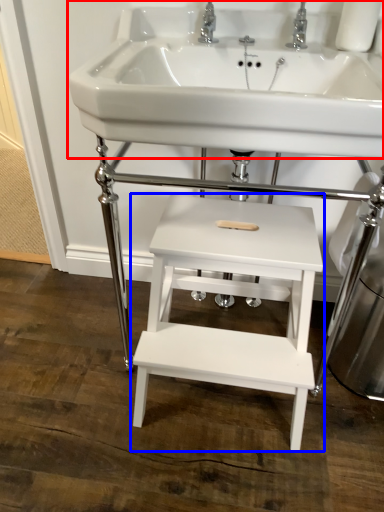
Question: Which object appears closest to the camera in this image, sink (highlighted by a red box) or table (highlighted by a blue box)?

Choices:
 (A) sink
 (B) table

Answer: (A)